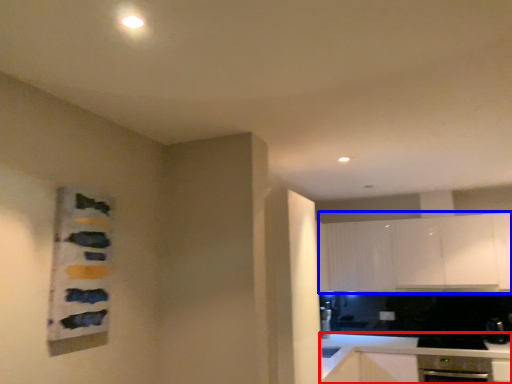
Question: Which object is further to the camera taking this photo, countertop (highlighted by a red box) or cabinetry (highlighted by a blue box)?

Choices:
 (A) countertop
 (B) cabinetry

Answer: (B)